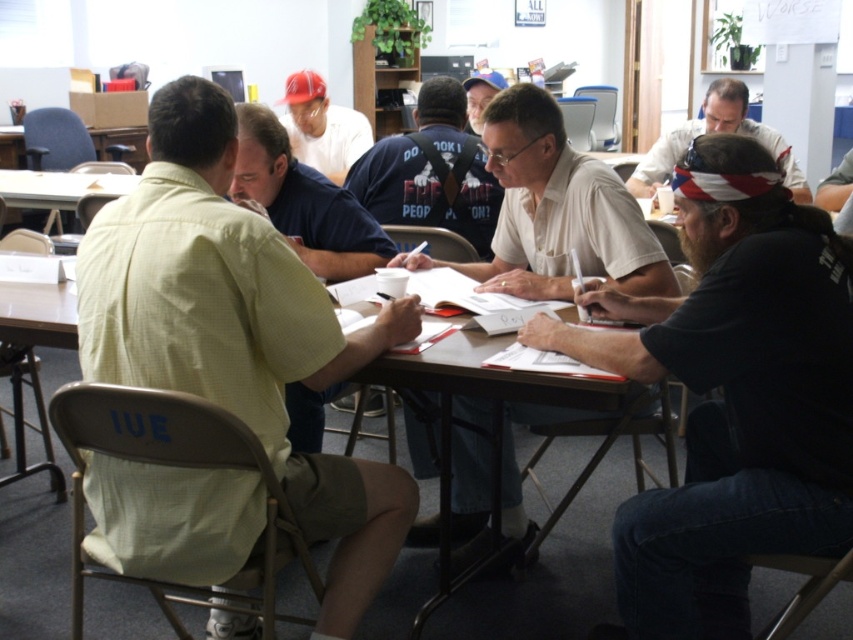
You are standing in front of the table in the meeting room. There are two points marked on the table. One is at coordinates point (x=39, y=316) and the other is at point (x=366, y=122). Which point is closer to you?

Point (x=39, y=316) is closer to the camera than point (x=366, y=122), so the point at coordinates point (x=39, y=316) is closer to you.